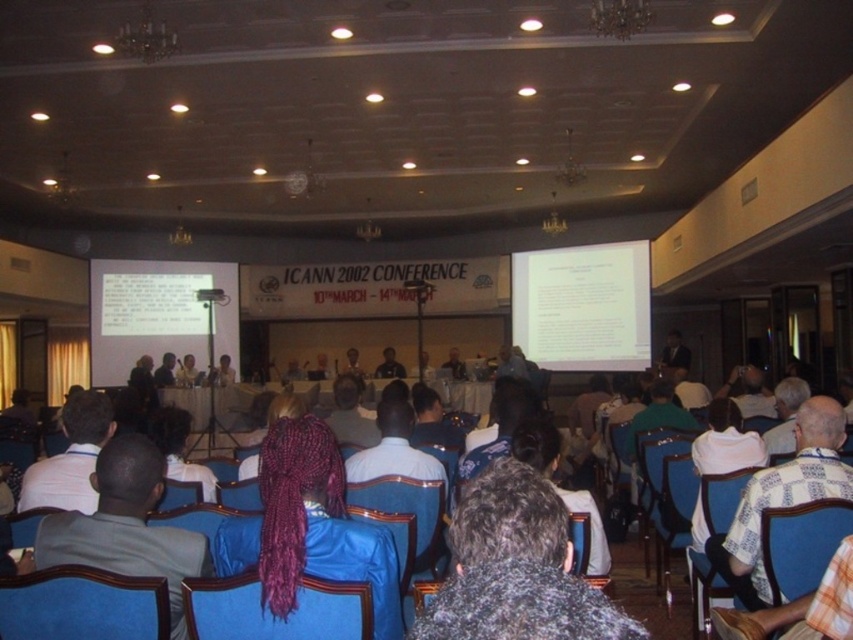
Which is behind, point (618, 336) or point (184, 285)?

Point (184, 285)

Is white paper at center taller than white matte projector screen at center?

Incorrect, white paper at center's height is not larger of white matte projector screen at center's.

Which is in front, point (635, 371) or point (221, 282)?

Point (635, 371) is in front.

I want to click on white paper at center, so click(583, 307).

Based on the photo, can you confirm if dark purple braided hair at center is positioned to the right of blue fabric chair at center?

Correct, you'll find dark purple braided hair at center to the right of blue fabric chair at center.

Describe the element at coordinates (309, 528) in the screenshot. This screenshot has height=640, width=853. I see `dark purple braided hair at center` at that location.

Identify the location of dark purple braided hair at center. This screenshot has width=853, height=640. (309, 528).

Is blue fabric chair at lower left to the right of dark blue fabric chair at center from the viewer's perspective?

Indeed, blue fabric chair at lower left is positioned on the right side of dark blue fabric chair at center.

From the picture: Does blue fabric chair at lower left appear on the left side of dark blue fabric chair at center?

Incorrect, blue fabric chair at lower left is not on the left side of dark blue fabric chair at center.

This screenshot has height=640, width=853. Find the location of `blue fabric chair at lower left`. blue fabric chair at lower left is located at coordinates 82,605.